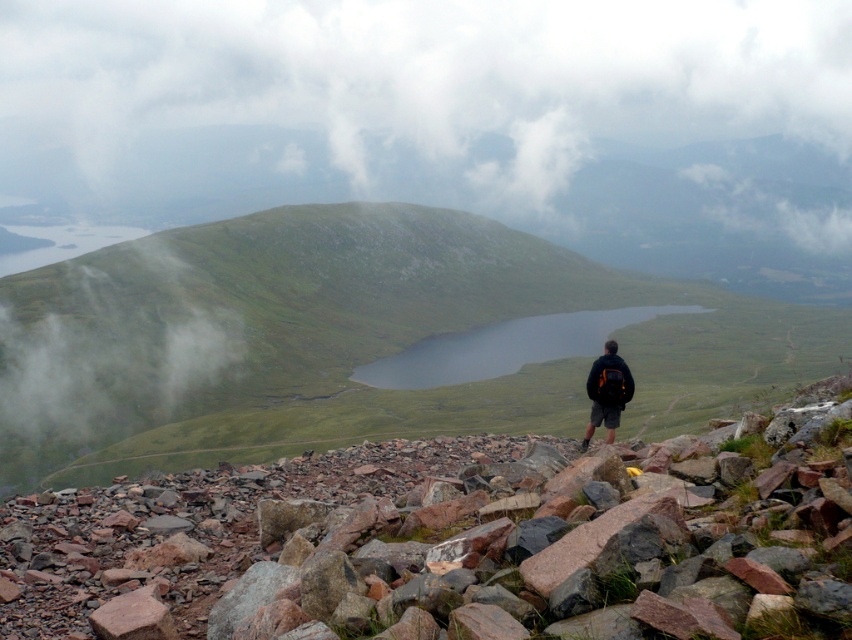
Question: Which of the following is the closest to the observer?

Choices:
 (A) rusty rock pile at center
 (B) white fluffy cloud at upper center

Answer: (A)

Question: Is white fluffy cloud at upper center to the left of rusty rock pile at center from the viewer's perspective?

Choices:
 (A) yes
 (B) no

Answer: (A)

Question: Which of the following is the farthest from the observer?

Choices:
 (A) 188,212
 (B) 614,369

Answer: (A)

Question: Does white fluffy cloud at upper center appear under rusty rock pile at center?

Choices:
 (A) yes
 (B) no

Answer: (B)

Question: Does rusty rock pile at center have a smaller size compared to dark blue jacket at center?

Choices:
 (A) no
 (B) yes

Answer: (A)

Question: Which object is farther from the camera taking this photo?

Choices:
 (A) dark blue jacket at center
 (B) rusty rock pile at center
 (C) white fluffy cloud at upper center

Answer: (C)